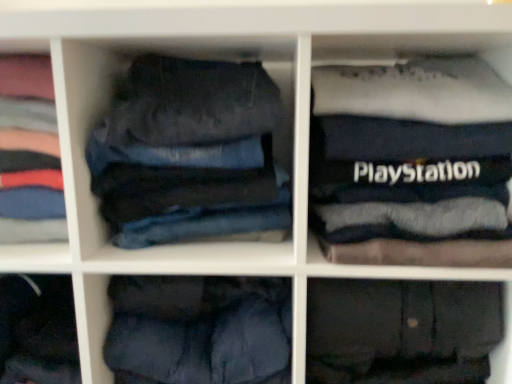
Where is `dark gray cotton trousers at lower right, marked as the third trousers in a left-to-right arrangement`? The width and height of the screenshot is (512, 384). dark gray cotton trousers at lower right, marked as the third trousers in a left-to-right arrangement is located at coordinates (401, 330).

This screenshot has height=384, width=512. Find the location of `black fabric playstation case at upper right, acting as the second clothing starting from the left`. black fabric playstation case at upper right, acting as the second clothing starting from the left is located at coordinates (412, 164).

Measure the distance between point (34, 205) and camera.

Point (34, 205) and camera are 28.58 inches apart from each other.

Find the location of a particular element. The image size is (512, 384). dark gray cotton trousers at lower right, the first trousers when ordered from right to left is located at coordinates (401, 330).

Are denim jeans at center, the first trousers positioned from the left, and dark blue cotton trousers at lower center, positioned as the 2th trousers in right-to-left order, far apart?

No, there isn't a large distance between denim jeans at center, the first trousers positioned from the left, and dark blue cotton trousers at lower center, positioned as the 2th trousers in right-to-left order.

Considering the sizes of objects denim jeans at center, which is counted as the 3th trousers, starting from the right, and dark blue cotton trousers at lower center, the second trousers positioned from the left, in the image provided, who is shorter, denim jeans at center, which is counted as the 3th trousers, starting from the right, or dark blue cotton trousers at lower center, the second trousers positioned from the left,?

dark blue cotton trousers at lower center, the second trousers positioned from the left.

From the image's perspective, which one is positioned higher, denim jeans at center, the first trousers positioned from the left, or dark blue cotton trousers at lower center, positioned as the 2th trousers in right-to-left order?

From the image's view, denim jeans at center, the first trousers positioned from the left, is above.

Looking at this image, considering the sizes of objects denim jeans at center, which is counted as the 3th trousers, starting from the right, and dark blue cotton trousers at lower center, positioned as the 2th trousers in right-to-left order, in the image provided, who is smaller, denim jeans at center, which is counted as the 3th trousers, starting from the right, or dark blue cotton trousers at lower center, positioned as the 2th trousers in right-to-left order,?

dark blue cotton trousers at lower center, positioned as the 2th trousers in right-to-left order.

Between black fabric playstation case at upper right, acting as the second clothing starting from the left, and dark blue cotton trousers at lower center, positioned as the 2th trousers in right-to-left order, which one has smaller width?

dark blue cotton trousers at lower center, positioned as the 2th trousers in right-to-left order.

Where is `trousers that is the 3rd object located behind the black fabric playstation case at upper right, which is the 1th clothing from right to left`? This screenshot has width=512, height=384. trousers that is the 3rd object located behind the black fabric playstation case at upper right, which is the 1th clothing from right to left is located at coordinates (200, 330).

Looking at the image, does black fabric playstation case at upper right, acting as the second clothing starting from the left, seem bigger or smaller compared to dark blue cotton trousers at lower center, the second trousers positioned from the left?

Clearly, black fabric playstation case at upper right, acting as the second clothing starting from the left, is larger in size than dark blue cotton trousers at lower center, the second trousers positioned from the left.

Could you tell me if black fabric playstation case at upper right, which is the 1th clothing from right to left, is turned towards dark blue cotton trousers at lower center, the second trousers positioned from the left?

No, black fabric playstation case at upper right, which is the 1th clothing from right to left, does not turn towards dark blue cotton trousers at lower center, the second trousers positioned from the left.

Is dark blue denim jeans at left, the 2th clothing from the right, spatially inside dark blue cotton trousers at lower center, the second trousers positioned from the left, or outside of it?

dark blue denim jeans at left, the 2th clothing from the right, exists outside the volume of dark blue cotton trousers at lower center, the second trousers positioned from the left.

Would you say dark blue denim jeans at left, the 2th clothing from the right, is to the left or to the right of dark blue cotton trousers at lower center, the second trousers positioned from the left, in the picture?

Clearly, dark blue denim jeans at left, the 2th clothing from the right, is on the left of dark blue cotton trousers at lower center, the second trousers positioned from the left, in the image.

From the picture: From their relative heights in the image, would you say dark blue denim jeans at left, the 2th clothing from the right, is taller or shorter than dark blue cotton trousers at lower center, the second trousers positioned from the left?

Considering their sizes, dark blue denim jeans at left, the 2th clothing from the right, has more height than dark blue cotton trousers at lower center, the second trousers positioned from the left.

From their relative heights in the image, would you say dark blue cotton trousers at lower center, positioned as the 2th trousers in right-to-left order, is taller or shorter than dark blue denim jeans at left, the 2th clothing from the right?

dark blue cotton trousers at lower center, positioned as the 2th trousers in right-to-left order, is shorter than dark blue denim jeans at left, the 2th clothing from the right.

How different are the orientations of dark blue cotton trousers at lower center, the second trousers positioned from the left, and dark blue denim jeans at left, the 2th clothing from the right, in degrees?

The facing directions of dark blue cotton trousers at lower center, the second trousers positioned from the left, and dark blue denim jeans at left, the 2th clothing from the right, are 0.000175 degrees apart.

Measure the distance from dark blue cotton trousers at lower center, positioned as the 2th trousers in right-to-left order, to dark blue denim jeans at left, the 2th clothing from the right.

They are 11.12 inches apart.

Which of these two, dark blue cotton trousers at lower center, positioned as the 2th trousers in right-to-left order, or dark blue denim jeans at left, the 2th clothing from the right, is wider?

dark blue cotton trousers at lower center, positioned as the 2th trousers in right-to-left order, is wider.

Based on the photo, considering the sizes of denim jeans at center, the first trousers positioned from the left, and dark blue denim jeans at left, which is the first clothing in left-to-right order, in the image, is denim jeans at center, the first trousers positioned from the left, wider or thinner than dark blue denim jeans at left, which is the first clothing in left-to-right order,?

Clearly, denim jeans at center, the first trousers positioned from the left, has more width compared to dark blue denim jeans at left, which is the first clothing in left-to-right order.

Between denim jeans at center, which is counted as the 3th trousers, starting from the right, and dark blue denim jeans at left, which is the first clothing in left-to-right order, which one is positioned in front?

denim jeans at center, which is counted as the 3th trousers, starting from the right, is in front.

Considering the sizes of objects denim jeans at center, the first trousers positioned from the left, and dark blue denim jeans at left, the 2th clothing from the right, in the image provided, who is smaller, denim jeans at center, the first trousers positioned from the left, or dark blue denim jeans at left, the 2th clothing from the right,?

dark blue denim jeans at left, the 2th clothing from the right, is smaller.

Measure the distance between denim jeans at center, the first trousers positioned from the left, and dark blue denim jeans at left, which is the first clothing in left-to-right order.

denim jeans at center, the first trousers positioned from the left, is 8.33 inches from dark blue denim jeans at left, which is the first clothing in left-to-right order.

Does point (434, 322) appear closer or farther from the camera than point (33, 156)?

Point (434, 322).

From the picture: Does dark gray cotton trousers at lower right, the first trousers when ordered from right to left, have a greater width compared to dark blue denim jeans at left, the 2th clothing from the right?

Correct, the width of dark gray cotton trousers at lower right, the first trousers when ordered from right to left, exceeds that of dark blue denim jeans at left, the 2th clothing from the right.

From a real-world perspective, is dark gray cotton trousers at lower right, the first trousers when ordered from right to left, below dark blue denim jeans at left, which is the first clothing in left-to-right order?

Yes.

I want to click on the 3rd trousers positioned below the black fabric playstation case at upper right, which is the 1th clothing from right to left (from a real-world perspective), so click(401, 330).

Considering the positions of points (476, 253) and (371, 322), is point (476, 253) farther from camera compared to point (371, 322)?

No.

Based on their positions, is black fabric playstation case at upper right, acting as the second clothing starting from the left, located to the left or right of dark gray cotton trousers at lower right, the first trousers when ordered from right to left?

Clearly, black fabric playstation case at upper right, acting as the second clothing starting from the left, is on the right of dark gray cotton trousers at lower right, the first trousers when ordered from right to left, in the image.

From a real-world perspective, which object stands above the other?

black fabric playstation case at upper right, acting as the second clothing starting from the left.

Find the location of a particular element. The height and width of the screenshot is (384, 512). the 1st trousers positioned below the denim jeans at center, which is counted as the 3th trousers, starting from the right (from a real-world perspective) is located at coordinates pyautogui.click(x=200, y=330).

You are a GUI agent. You are given a task and a screenshot of the screen. Output one action in this format:
    pyautogui.click(x=<x>, y=<y>)
    Task: Click on the 1st clothing above when counting from the dark blue cotton trousers at lower center, the second trousers positioned from the left (from the image's perspective)
    This screenshot has height=384, width=512.
    Given the screenshot: What is the action you would take?
    pyautogui.click(x=412, y=164)

Looking at the image, which one is located closer to black fabric playstation case at upper right, which is the 1th clothing from right to left, dark blue denim jeans at left, which is the first clothing in left-to-right order, or dark gray cotton trousers at lower right, marked as the third trousers in a left-to-right arrangement?

Based on the image, dark gray cotton trousers at lower right, marked as the third trousers in a left-to-right arrangement, appears to be nearer to black fabric playstation case at upper right, which is the 1th clothing from right to left.

Considering their positions, is denim jeans at center, which is counted as the 3th trousers, starting from the right, positioned further to dark blue cotton trousers at lower center, positioned as the 2th trousers in right-to-left order, than dark blue denim jeans at left, the 2th clothing from the right?

Among the two, dark blue denim jeans at left, the 2th clothing from the right, is located further to dark blue cotton trousers at lower center, positioned as the 2th trousers in right-to-left order.

Based on their spatial positions, is dark gray cotton trousers at lower right, marked as the third trousers in a left-to-right arrangement, or black fabric playstation case at upper right, acting as the second clothing starting from the left, further from dark blue cotton trousers at lower center, positioned as the 2th trousers in right-to-left order?

Among the two, black fabric playstation case at upper right, acting as the second clothing starting from the left, is located further to dark blue cotton trousers at lower center, positioned as the 2th trousers in right-to-left order.

When comparing their distances from denim jeans at center, the first trousers positioned from the left, does dark gray cotton trousers at lower right, marked as the third trousers in a left-to-right arrangement, or black fabric playstation case at upper right, acting as the second clothing starting from the left, seem further?

dark gray cotton trousers at lower right, marked as the third trousers in a left-to-right arrangement.

Estimate the real-world distances between objects in this image. Which object is further from black fabric playstation case at upper right, acting as the second clothing starting from the left, dark gray cotton trousers at lower right, the first trousers when ordered from right to left, or dark blue denim jeans at left, which is the first clothing in left-to-right order?

dark blue denim jeans at left, which is the first clothing in left-to-right order, lies further to black fabric playstation case at upper right, acting as the second clothing starting from the left, than the other object.

Estimate the real-world distances between objects in this image. Which object is closer to black fabric playstation case at upper right, acting as the second clothing starting from the left, dark blue denim jeans at left, which is the first clothing in left-to-right order, or denim jeans at center, the first trousers positioned from the left?

denim jeans at center, the first trousers positioned from the left, is positioned closer to the anchor black fabric playstation case at upper right, acting as the second clothing starting from the left.

Based on their spatial positions, is dark blue denim jeans at left, which is the first clothing in left-to-right order, or dark blue cotton trousers at lower center, positioned as the 2th trousers in right-to-left order, closer to dark gray cotton trousers at lower right, the first trousers when ordered from right to left?

dark blue cotton trousers at lower center, positioned as the 2th trousers in right-to-left order.

Considering their positions, is dark gray cotton trousers at lower right, marked as the third trousers in a left-to-right arrangement, positioned closer to dark blue denim jeans at left, the 2th clothing from the right, than denim jeans at center, which is counted as the 3th trousers, starting from the right?

denim jeans at center, which is counted as the 3th trousers, starting from the right, lies closer to dark blue denim jeans at left, the 2th clothing from the right, than the other object.

Where is `trousers located between dark blue denim jeans at left, which is the first clothing in left-to-right order, and dark blue cotton trousers at lower center, the second trousers positioned from the left, in the left-right direction`? The image size is (512, 384). trousers located between dark blue denim jeans at left, which is the first clothing in left-to-right order, and dark blue cotton trousers at lower center, the second trousers positioned from the left, in the left-right direction is located at coordinates (189, 153).

I want to click on trousers between dark blue cotton trousers at lower center, positioned as the 2th trousers in right-to-left order, and black fabric playstation case at upper right, acting as the second clothing starting from the left, from left to right, so click(x=401, y=330).

At what (x,y) coordinates should I click in order to perform the action: click on trousers situated between denim jeans at center, which is counted as the 3th trousers, starting from the right, and dark gray cotton trousers at lower right, the first trousers when ordered from right to left, from left to right. Please return your answer as a coordinate pair (x, y). Looking at the image, I should click on (200, 330).